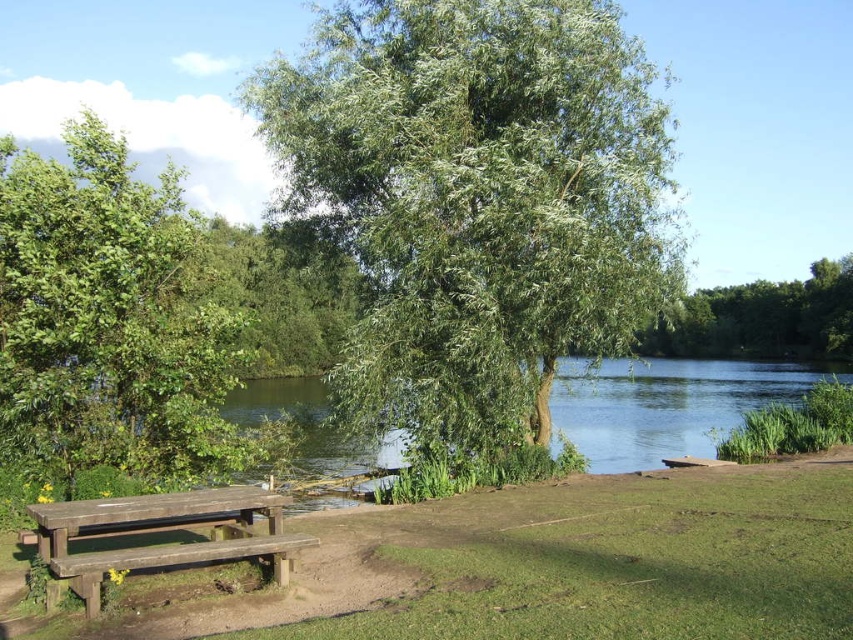
Question: Can you confirm if green leafy tree at center is bigger than green leafy tree at upper center?

Choices:
 (A) yes
 (B) no

Answer: (B)

Question: Considering the real-world distances, which object is farthest from the green leafy tree at upper center?

Choices:
 (A) green grass at lower center
 (B) weathered wood picnic table at lower left

Answer: (A)

Question: Among these points, which one is farthest from the camera?

Choices:
 (A) (20, 307)
 (B) (80, 538)

Answer: (A)

Question: Is green leafy tree at upper left behind weathered wood picnic table at lower left?

Choices:
 (A) no
 (B) yes

Answer: (B)

Question: Estimate the real-world distances between objects in this image. Which object is farther from the green leafy tree at upper center?

Choices:
 (A) weathered wood picnic table at lower left
 (B) green leafy tree at center
 (C) green leafy tree at upper left

Answer: (C)

Question: Does green leafy tree at upper left appear over weathered wood picnic table at lower left?

Choices:
 (A) yes
 (B) no

Answer: (A)